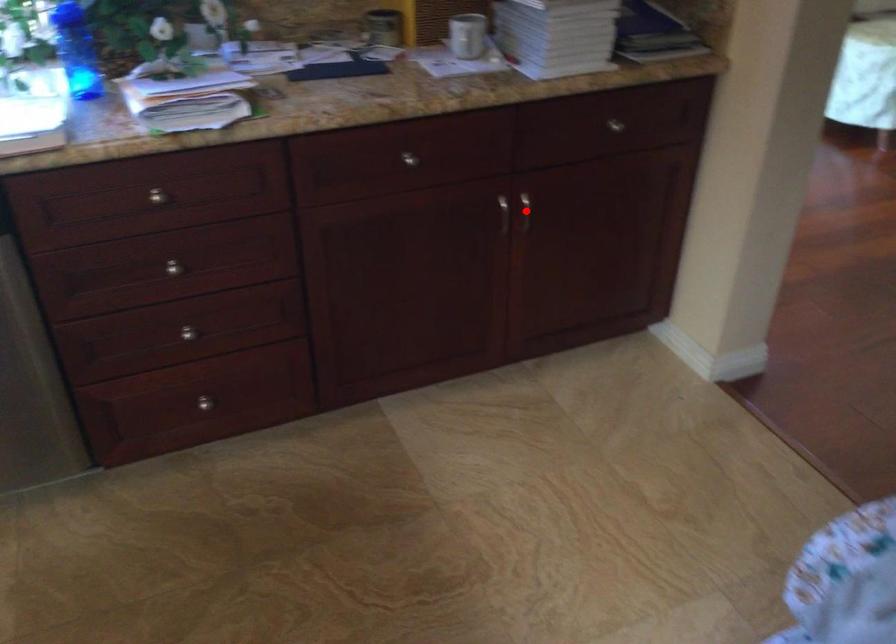
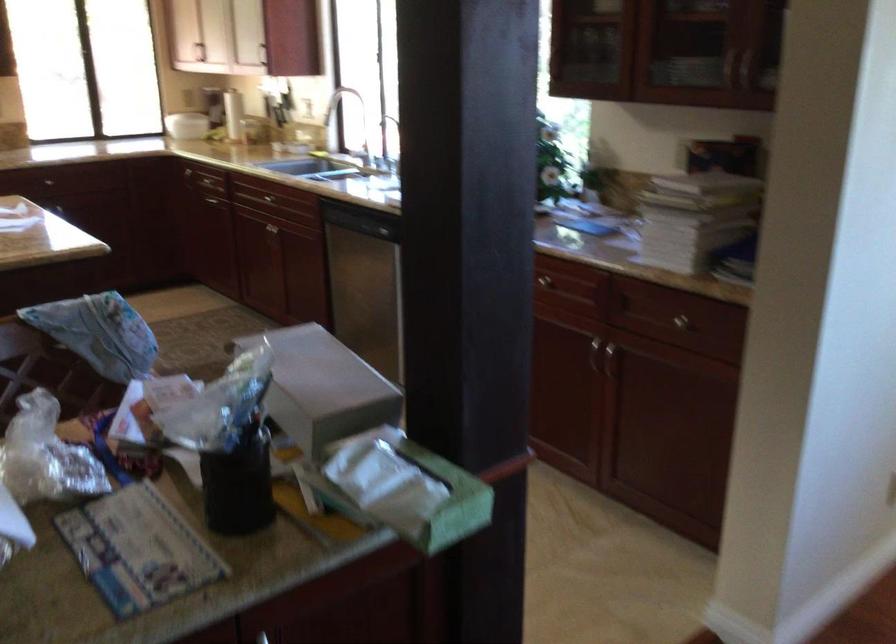
Locate, in the second image, the point that corresponds to the highlighted location in the first image.

(610, 361)